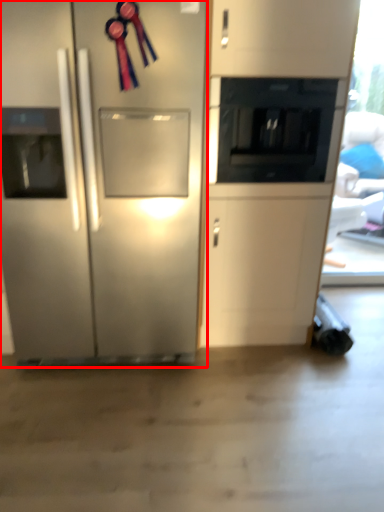
Question: From the image's perspective, what is the correct spatial positioning of refrigerator (annotated by the red box) in reference to appliance?

Choices:
 (A) above
 (B) below

Answer: (B)